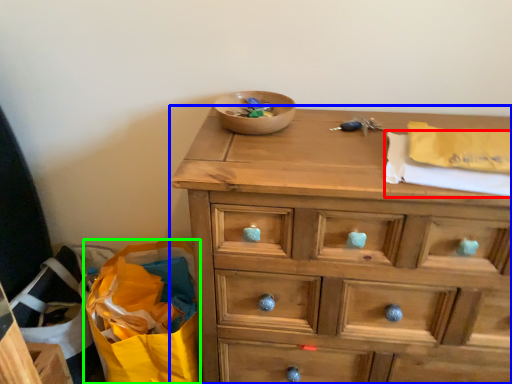
Question: Based on their relative distances, which object is nearer to clothe (highlighted by a red box)? Choose from chest of drawers (highlighted by a blue box) and shopping bag (highlighted by a green box).

Choices:
 (A) chest of drawers
 (B) shopping bag

Answer: (A)